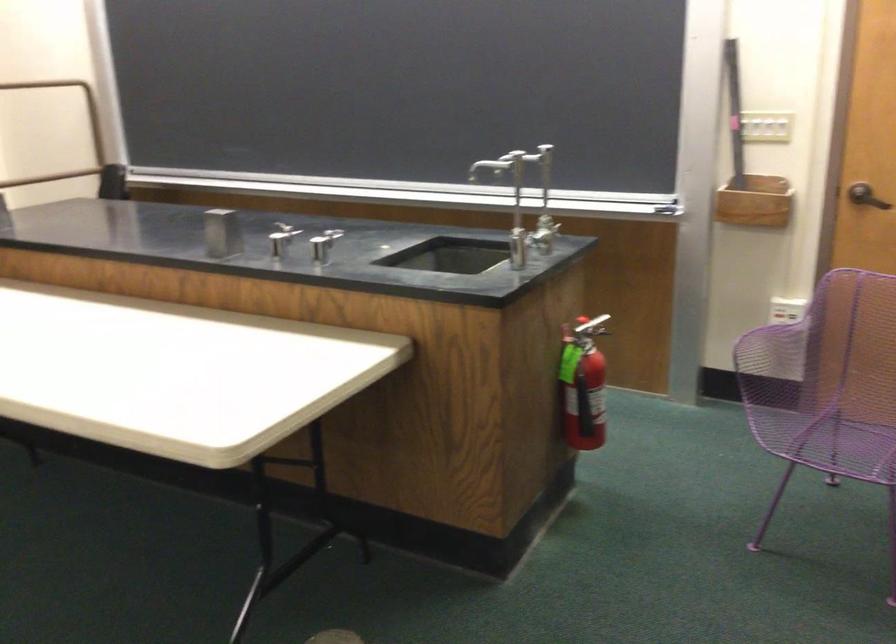
Where is `fire extinguisher handle`? The width and height of the screenshot is (896, 644). fire extinguisher handle is located at coordinates (590, 327).